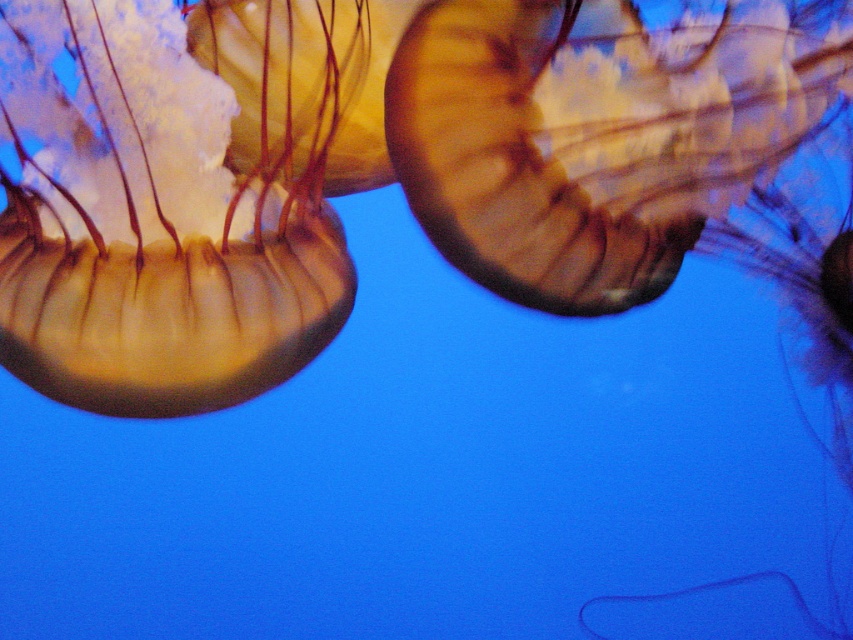
You are a marine biologist observing two jellyfish in an underwater scene. You notice the translucent gelatinous at left and the translucent gelatinous at upper right. Which of these two jellyfish has a larger bell size?

The translucent gelatinous at left has a larger bell size since it is taller than the translucent gelatinous at upper right.

You are a marine biologist observing two jellyfish in the ocean. You notice a translucent gelatinous at left and a translucent gelatinous at upper right. Which one is positioned lower in the water?

The translucent gelatinous at left is positioned lower than the translucent gelatinous at upper right because it is below it.

You are a marine biologist observing two jellyfish in an underwater scene. You notice the translucent gelatinous at left and the translucent gelatinous at upper right. Which one would cast a bigger shadow if the light source is above them?

The translucent gelatinous at left is larger in size compared to the translucent gelatinous at upper right, so it would cast a bigger shadow.